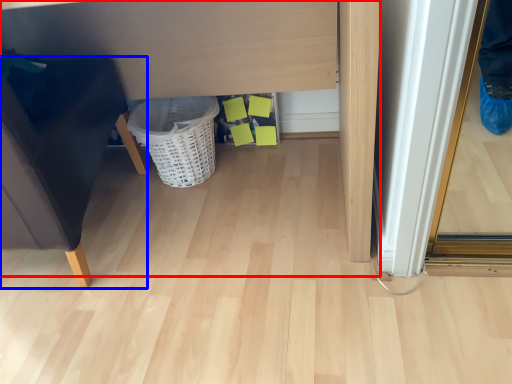
Question: Among these objects, which one is nearest to the camera, vanity (highlighted by a red box) or furniture (highlighted by a blue box)?

Choices:
 (A) vanity
 (B) furniture

Answer: (B)